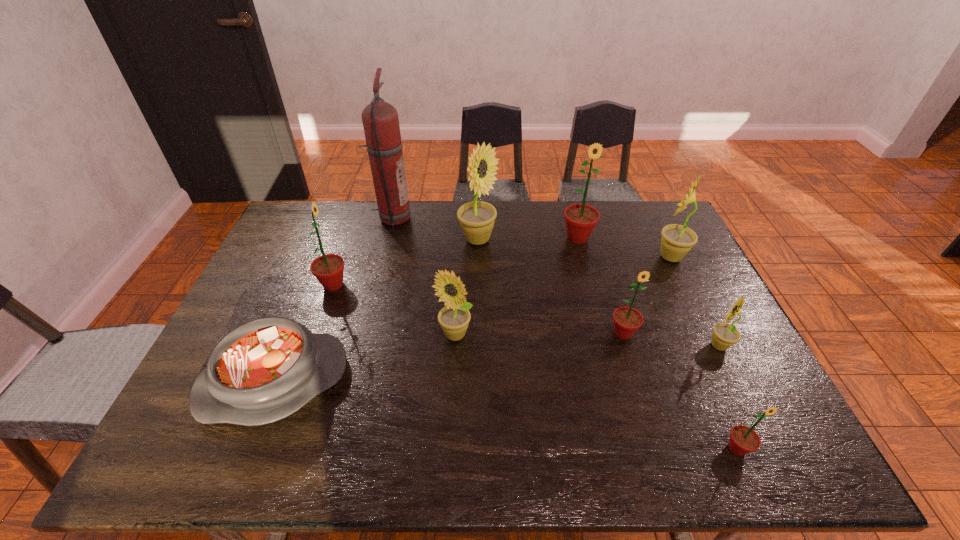
Where is `sunflower that is the second closest one to the leftmost sunflower`? sunflower that is the second closest one to the leftmost sunflower is located at coordinates (476, 218).

Select which yellow sunflower appears as the third closest to the third biggest green sunflower. Please provide its 2D coordinates. Your answer should be formatted as a tuple, i.e. [(x, y)], where the tuple contains the x and y coordinates of a point satisfying the conditions above.

[(454, 318)]

Find the location of a particular element. The image size is (960, 540). yellow sunflower that stands as the closest to the shortest object is located at coordinates (454, 318).

Locate which green sunflower ranks fourth in proximity to the biggest yellow sunflower. Please provide its 2D coordinates. Your answer should be formatted as a tuple, i.e. [(x, y)], where the tuple contains the x and y coordinates of a point satisfying the conditions above.

[(743, 439)]

Choose which green sunflower is the third nearest neighbor to the second farthest green sunflower. Please provide its 2D coordinates. Your answer should be formatted as a tuple, i.e. [(x, y)], where the tuple contains the x and y coordinates of a point satisfying the conditions above.

[(743, 439)]